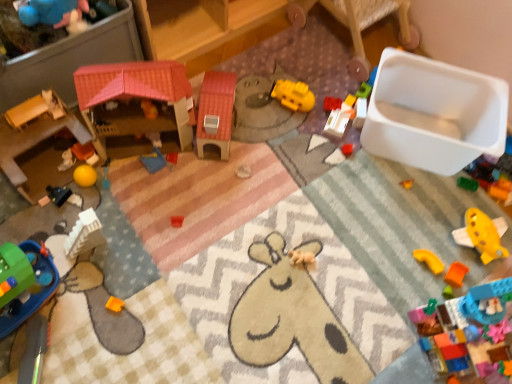
Locate an element on the screen. The width and height of the screenshot is (512, 384). vacant area that lies between yellow matte plastic arch at lower right, acting as the 4th toy starting from the right, and smooth wooden dollhouse at left, placed as the 15th toy when sorted from right to left is located at coordinates [239, 217].